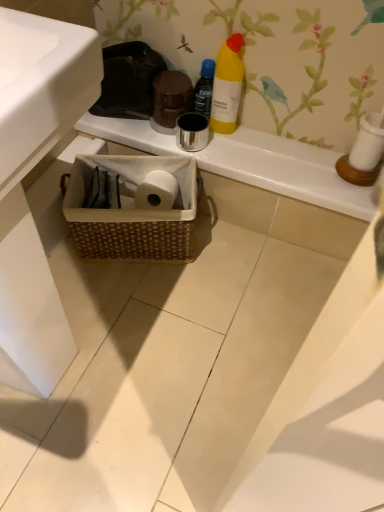
This screenshot has height=512, width=384. What are the coordinates of `woven basket at center` in the screenshot? It's located at (251, 162).

This screenshot has width=384, height=512. What do you see at coordinates (251, 162) in the screenshot?
I see `woven basket at center` at bounding box center [251, 162].

What do you see at coordinates (204, 89) in the screenshot?
I see `yellow matte bottle at upper center, the first bottle when ordered from left to right` at bounding box center [204, 89].

This screenshot has height=512, width=384. Describe the element at coordinates (131, 208) in the screenshot. I see `woven brown basket at lower center` at that location.

Where is `woven basket at center`? This screenshot has height=512, width=384. woven basket at center is located at coordinates (251, 162).

Where is `the 1st bottle directly above the woven brown basket at lower center (from a real-world perspective)`? The width and height of the screenshot is (384, 512). the 1st bottle directly above the woven brown basket at lower center (from a real-world perspective) is located at coordinates (204, 89).

Is woven brown basket at lower center smaller than yellow matte bottle at upper center, positioned as the second bottle in right-to-left order?

Incorrect, woven brown basket at lower center is not smaller in size than yellow matte bottle at upper center, positioned as the second bottle in right-to-left order.

Based on the photo, how many degrees apart are the facing directions of woven brown basket at lower center and yellow matte bottle at upper center, the first bottle when ordered from left to right?

The angular difference between woven brown basket at lower center and yellow matte bottle at upper center, the first bottle when ordered from left to right, is 23.2 degrees.

Is yellow matte bottle at upper center, the first bottle when ordered from left to right, surrounded by woven brown basket at lower center?

No, yellow matte bottle at upper center, the first bottle when ordered from left to right, is not surrounded by woven brown basket at lower center.

From a real-world perspective, is woven basket at center below yellow matte bottle at upper center, which is the 1th bottle in right-to-left order?

Indeed, from a real-world perspective, woven basket at center is positioned beneath yellow matte bottle at upper center, which is the 1th bottle in right-to-left order.

From the picture: Is the position of woven basket at center less distant than that of yellow matte bottle at upper center, which is the 2th bottle in left-to-right order?

No, it is not.

Does point (285, 145) appear closer or farther from the camera than point (220, 53)?

Point (285, 145).

Is woven basket at center bigger or smaller than yellow matte bottle at upper center, which is the 2th bottle in left-to-right order?

Considering their sizes, woven basket at center takes up more space than yellow matte bottle at upper center, which is the 2th bottle in left-to-right order.

Does woven brown basket at lower center appear on the left side of woven basket at center?

Indeed, woven brown basket at lower center is positioned on the left side of woven basket at center.

Which is in front, point (135, 172) or point (151, 143)?

The point (135, 172) is in front.

How much distance is there between woven brown basket at lower center and woven basket at center?

woven brown basket at lower center and woven basket at center are 8.24 inches apart from each other.

Is woven brown basket at lower center positioned before woven basket at center?

Yes, woven brown basket at lower center is in front of woven basket at center.

Consider the image. Is the depth of yellow matte bottle at upper center, which is the 2th bottle in left-to-right order, greater than that of woven brown basket at lower center?

No, the depth of yellow matte bottle at upper center, which is the 2th bottle in left-to-right order, is less than that of woven brown basket at lower center.

Find the location of a particular element. picnic basket that is on the left side of yellow matte bottle at upper center, which is the 2th bottle in left-to-right order is located at coordinates (131, 208).

Between yellow matte bottle at upper center, which is the 1th bottle in right-to-left order, and woven brown basket at lower center, which one appears on the right side from the viewer's perspective?

Positioned to the right is yellow matte bottle at upper center, which is the 1th bottle in right-to-left order.

Is yellow matte bottle at upper center, which is the 2th bottle in left-to-right order, taller or shorter than woven brown basket at lower center?

yellow matte bottle at upper center, which is the 2th bottle in left-to-right order, is taller than woven brown basket at lower center.

From the picture: In the image, is yellow matte bottle at upper center, which is the 1th bottle in right-to-left order, on the left side or the right side of white glossy sink at lower left?

From the image, it's evident that yellow matte bottle at upper center, which is the 1th bottle in right-to-left order, is to the right of white glossy sink at lower left.

From a real-world perspective, which is physically below, yellow matte bottle at upper center, which is the 2th bottle in left-to-right order, or white glossy sink at lower left?

yellow matte bottle at upper center, which is the 2th bottle in left-to-right order, from a real-world perspective.

Based on the photo, is yellow matte bottle at upper center, which is the 1th bottle in right-to-left order, facing away from white glossy sink at lower left?

No.

Which object is more forward, yellow matte bottle at upper center, which is the 1th bottle in right-to-left order, or white glossy sink at lower left?

white glossy sink at lower left is in front.

From the image's perspective, is white glossy sink at lower left positioned above or below woven basket at center?

Clearly, from the image's perspective, white glossy sink at lower left is below woven basket at center.

Can woven basket at center be found inside white glossy sink at lower left?

That's incorrect, woven basket at center is not inside white glossy sink at lower left.

Is the surface of white glossy sink at lower left in direct contact with woven basket at center?

No, white glossy sink at lower left is not with woven basket at center.

This screenshot has width=384, height=512. Find the location of `counter top on the right of white glossy sink at lower left`. counter top on the right of white glossy sink at lower left is located at coordinates 251,162.

Is white glossy sink at lower left completely or partially inside woven brown basket at lower center?

→ Actually, white glossy sink at lower left is outside woven brown basket at lower center.

Considering the sizes of woven brown basket at lower center and white glossy sink at lower left in the image, is woven brown basket at lower center taller or shorter than white glossy sink at lower left?

woven brown basket at lower center is shorter than white glossy sink at lower left.

Which of these two, woven brown basket at lower center or white glossy sink at lower left, is thinner?

woven brown basket at lower center is thinner.

Is woven brown basket at lower center positioned in front of white glossy sink at lower left?

No, woven brown basket at lower center is further to the viewer.

The height and width of the screenshot is (512, 384). What are the coordinates of `picnic basket below the yellow matte bottle at upper center, the first bottle when ordered from left to right (from the image's perspective)` in the screenshot? It's located at (131, 208).

You are a GUI agent. You are given a task and a screenshot of the screen. Output one action in this format:
    pyautogui.click(x=<x>, y=<y>)
    Task: Click on the 1st bottle to the left of the woven basket at center, starting your count from the anchor
    The height and width of the screenshot is (512, 384).
    Given the screenshot: What is the action you would take?
    pyautogui.click(x=227, y=86)

Looking at the image, which one is located closer to woven brown basket at lower center, white glossy sink at lower left or yellow matte bottle at upper center, positioned as the second bottle in right-to-left order?

yellow matte bottle at upper center, positioned as the second bottle in right-to-left order.

Looking at the image, which one is located further to white glossy sink at lower left, yellow matte bottle at upper center, which is the 1th bottle in right-to-left order, or yellow matte bottle at upper center, positioned as the second bottle in right-to-left order?

yellow matte bottle at upper center, positioned as the second bottle in right-to-left order, is further to white glossy sink at lower left.

Considering their positions, is yellow matte bottle at upper center, positioned as the second bottle in right-to-left order, positioned further to white glossy sink at lower left than yellow matte bottle at upper center, which is the 1th bottle in right-to-left order?

Based on the image, yellow matte bottle at upper center, positioned as the second bottle in right-to-left order, appears to be further to white glossy sink at lower left.

Based on their spatial positions, is white glossy sink at lower left or yellow matte bottle at upper center, the first bottle when ordered from left to right, closer to woven basket at center?

Based on the image, yellow matte bottle at upper center, the first bottle when ordered from left to right, appears to be nearer to woven basket at center.

Looking at the image, which one is located further to white glossy sink at lower left, woven basket at center or yellow matte bottle at upper center, the first bottle when ordered from left to right?

yellow matte bottle at upper center, the first bottle when ordered from left to right, lies further to white glossy sink at lower left than the other object.

From the picture: Considering their positions, is white glossy sink at lower left positioned closer to yellow matte bottle at upper center, positioned as the second bottle in right-to-left order, than yellow matte bottle at upper center, which is the 1th bottle in right-to-left order?

yellow matte bottle at upper center, which is the 1th bottle in right-to-left order, is closer to yellow matte bottle at upper center, positioned as the second bottle in right-to-left order.

Which object lies further to the anchor point woven basket at center, yellow matte bottle at upper center, which is the 1th bottle in right-to-left order, or white glossy sink at lower left?

white glossy sink at lower left is positioned further to the anchor woven basket at center.

From the image, which object appears to be nearer to woven brown basket at lower center, yellow matte bottle at upper center, which is the 1th bottle in right-to-left order, or woven basket at center?

Based on the image, woven basket at center appears to be nearer to woven brown basket at lower center.

You are a GUI agent. You are given a task and a screenshot of the screen. Output one action in this format:
    pyautogui.click(x=<x>, y=<y>)
    Task: Click on the bottle between white glossy sink at lower left and woven brown basket at lower center along the z-axis
    
    Given the screenshot: What is the action you would take?
    pyautogui.click(x=227, y=86)

In order to click on bottle located between white glossy sink at lower left and yellow matte bottle at upper center, positioned as the second bottle in right-to-left order, in the depth direction in this screenshot , I will do `click(227, 86)`.

You are a GUI agent. You are given a task and a screenshot of the screen. Output one action in this format:
    pyautogui.click(x=<x>, y=<y>)
    Task: Click on the bottle between yellow matte bottle at upper center, positioned as the second bottle in right-to-left order, and woven basket at center, in the vertical direction
    The image size is (384, 512).
    Given the screenshot: What is the action you would take?
    pyautogui.click(x=227, y=86)

Where is `picnic basket between white glossy sink at lower left and yellow matte bottle at upper center, the first bottle when ordered from left to right, along the z-axis`? The width and height of the screenshot is (384, 512). picnic basket between white glossy sink at lower left and yellow matte bottle at upper center, the first bottle when ordered from left to right, along the z-axis is located at coordinates (131, 208).